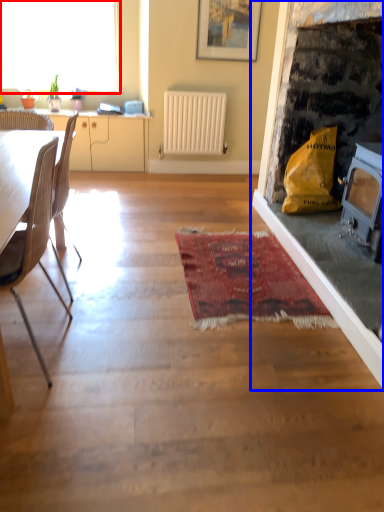
Question: Which of the following is the farthest to the observer, window (highlighted by a red box) or fireplace (highlighted by a blue box)?

Choices:
 (A) window
 (B) fireplace

Answer: (A)